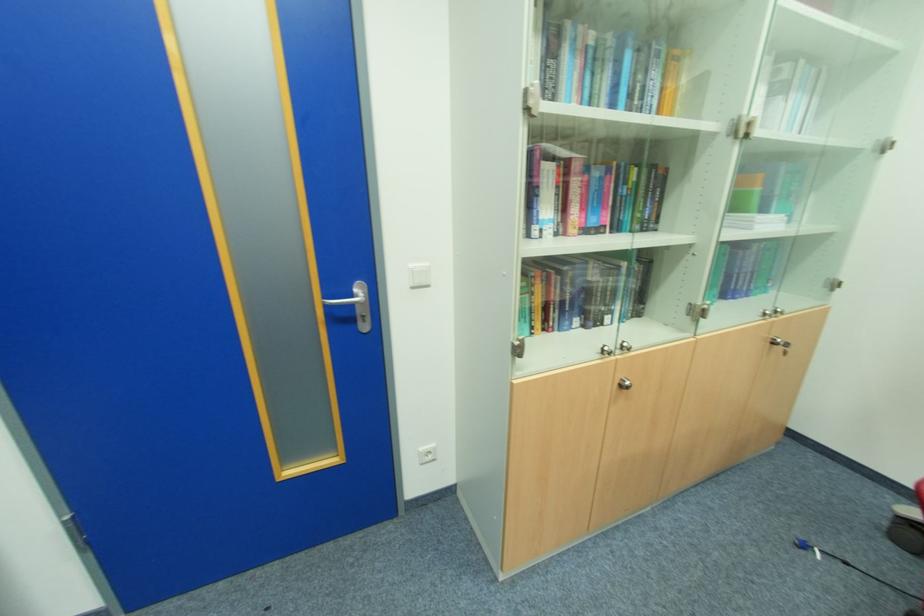
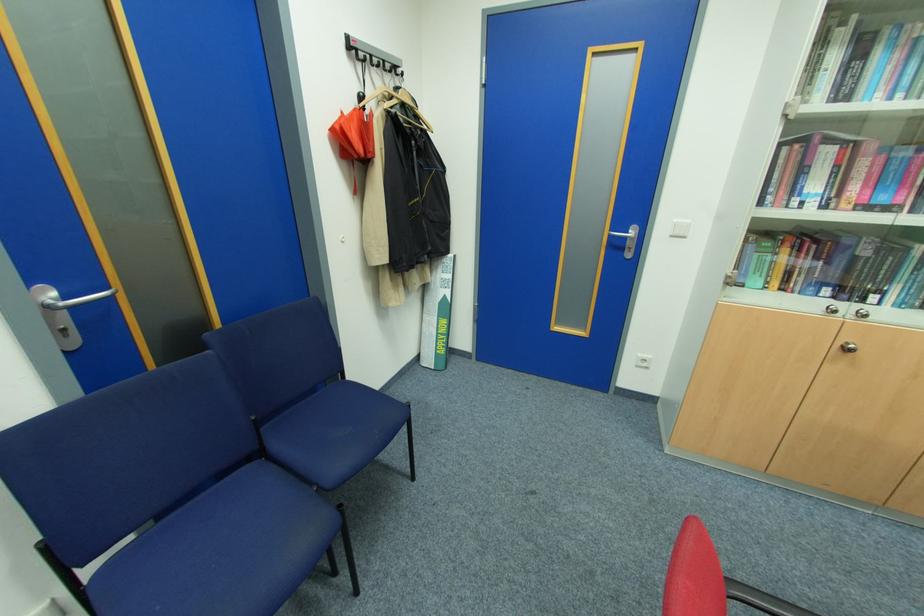
Find the pixel in the second image that matches [424,450] in the first image.

(642, 355)